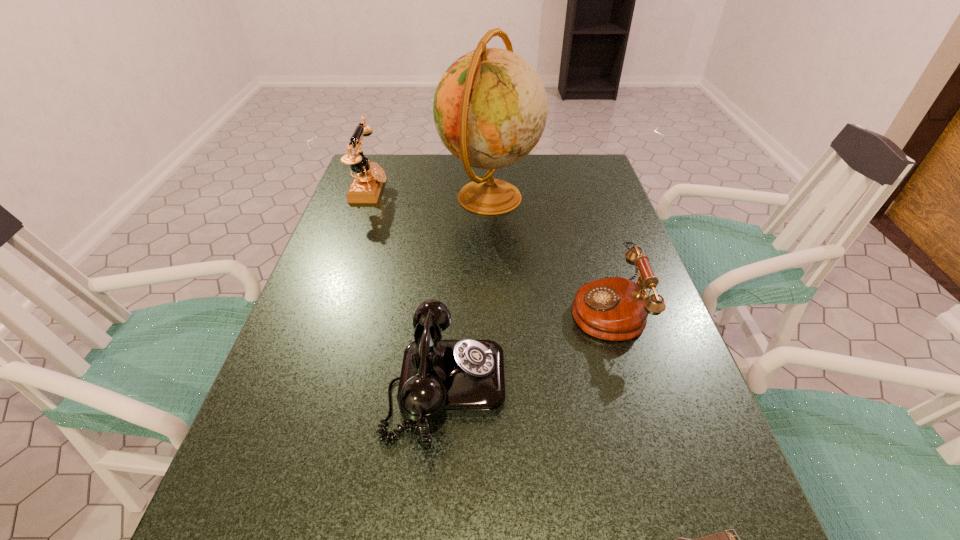
Where is `free spot between the rightmost telephone and the leftmost object`? The image size is (960, 540). free spot between the rightmost telephone and the leftmost object is located at coordinates (488, 249).

At what (x,y) coordinates should I click in order to perform the action: click on empty space that is in between the rightmost telephone and the second telephone from left to right. Please return your answer as a coordinate pair (x, y). This screenshot has width=960, height=540. Looking at the image, I should click on click(526, 347).

Where is `free space between the second tallest object and the globe`? free space between the second tallest object and the globe is located at coordinates (429, 193).

The image size is (960, 540). I want to click on unoccupied position between the second telephone from right to left and the tallest telephone, so click(408, 287).

Where is `free space between the rightmost telephone and the second telephone from left to right`? The image size is (960, 540). free space between the rightmost telephone and the second telephone from left to right is located at coordinates (526, 347).

Locate an element on the screen. The width and height of the screenshot is (960, 540). free point between the rightmost telephone and the tallest object is located at coordinates (547, 253).

Identify the location of vacant space that is in between the rightmost telephone and the globe. (547, 253).

The width and height of the screenshot is (960, 540). What are the coordinates of `free area in between the rightmost telephone and the second telephone from left to right` in the screenshot? It's located at (526, 347).

Identify which object is located as the third nearest to the leftmost telephone. Please provide its 2D coordinates. Your answer should be formatted as a tuple, i.e. [(x, y)], where the tuple contains the x and y coordinates of a point satisfying the conditions above.

[(616, 309)]

Find the location of a particular element. This screenshot has height=540, width=960. object that is the second nearest to the second telephone from right to left is located at coordinates (725, 539).